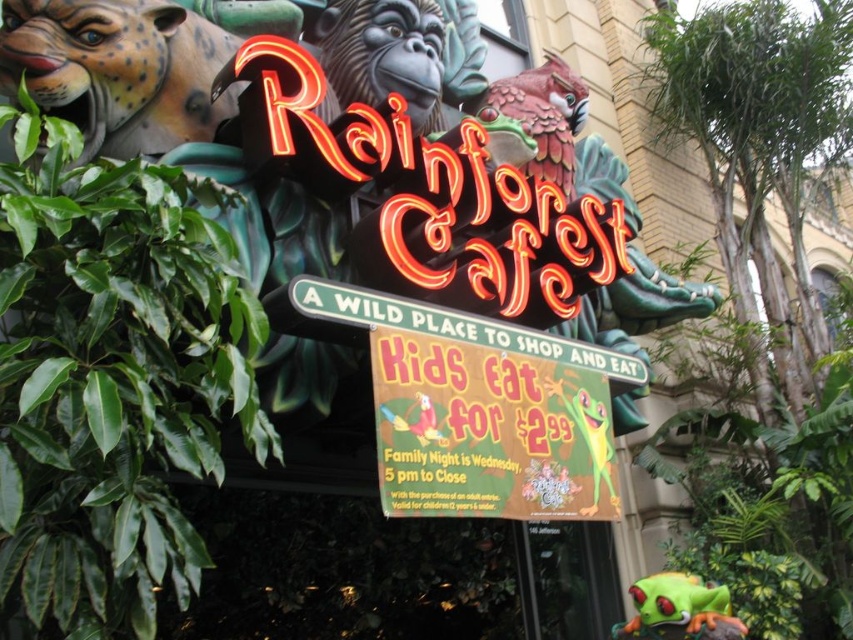
Does green plastic street sign at center come behind shiny metallic parrot at upper center?

That is False.

Is green plastic street sign at center smaller than shiny metallic parrot at upper center?

Correct, green plastic street sign at center occupies less space than shiny metallic parrot at upper center.

Find the location of `green plastic street sign at center`. green plastic street sign at center is located at coordinates (451, 326).

Locate an element on the screen. Image resolution: width=853 pixels, height=640 pixels. green plastic street sign at center is located at coordinates (451, 326).

Between bright yellow paper sign at center and shiny metallic parrot at upper center, which one has less height?

bright yellow paper sign at center

Does bright yellow paper sign at center have a smaller size compared to shiny metallic parrot at upper center?

Correct, bright yellow paper sign at center occupies less space than shiny metallic parrot at upper center.

Is point (560, 484) behind point (582, 92)?

No, it is in front of (582, 92).

Identify the location of bright yellow paper sign at center. (488, 433).

Does green plastic street sign at center come in front of green matte frog at center?

Yes, it is in front of green matte frog at center.

Who is lower down, green plastic street sign at center or green matte frog at center?

Positioned lower is green matte frog at center.

Is point (544, 353) closer to camera compared to point (653, 598)?

No, (544, 353) is further to viewer.

The image size is (853, 640). What are the coordinates of `green plastic street sign at center` in the screenshot? It's located at (451, 326).